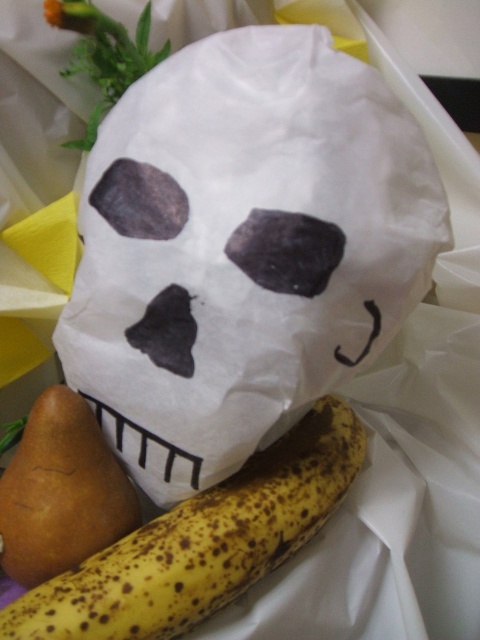
Which is more to the right, yellow spotted banana at center or matte black nose at center?

Positioned to the right is yellow spotted banana at center.

Who is taller, yellow spotted banana at center or matte black nose at center?

With more height is yellow spotted banana at center.

Between point (257, 525) and point (197, 269), which one is positioned in front?

Point (197, 269) is in front.

The image size is (480, 640). Find the location of `yellow spotted banana at center`. yellow spotted banana at center is located at coordinates (203, 541).

Who is taller, white paper skull at center or yellow spotted banana at center?

Standing taller between the two is white paper skull at center.

Identify the location of white paper skull at center. Image resolution: width=480 pixels, height=640 pixels. (243, 248).

Does point (278, 396) come closer to viewer compared to point (144, 576)?

That is False.

I want to click on white paper skull at center, so click(x=243, y=248).

Does point (255, 422) lie behind point (19, 538)?

No.

What do you see at coordinates (243, 248) in the screenshot?
I see `white paper skull at center` at bounding box center [243, 248].

The width and height of the screenshot is (480, 640). What are the coordinates of `white paper skull at center` in the screenshot? It's located at (243, 248).